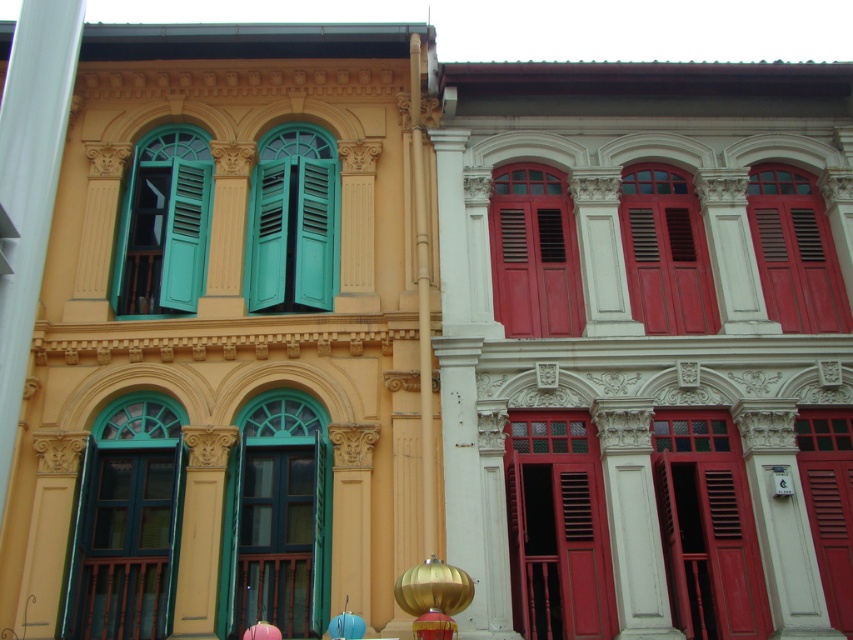
Question: Which point is farther to the camera?

Choices:
 (A) (672, 330)
 (B) (793, 276)
 (C) (532, 616)
 (D) (289, 408)

Answer: (B)

Question: Which point is closer to the camera?

Choices:
 (A) matte red shutter at center
 (B) green matte window at left
 (C) matte yellow wood pillar at center

Answer: (C)

Question: Does green matte window at center appear over matte red wooden window at center?

Choices:
 (A) no
 (B) yes

Answer: (B)

Question: Does matte red window at center have a lesser width compared to matte yellow wood pillar at center?

Choices:
 (A) no
 (B) yes

Answer: (A)

Question: Does teal wooden shutters at left appear on the right side of matte wood window at center?

Choices:
 (A) no
 (B) yes

Answer: (A)

Question: Which point is closer to the camera?

Choices:
 (A) green matte window at left
 (B) matte wood window at center
 (C) matte red shutter at center

Answer: (A)